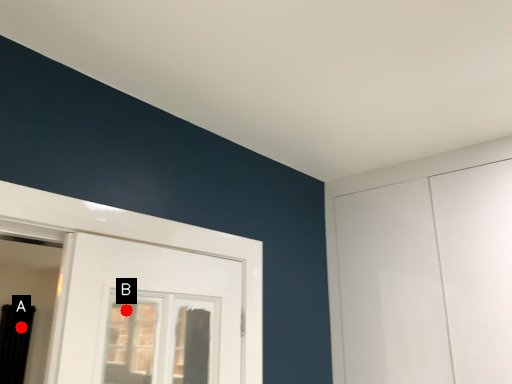
Question: Two points are circled on the image, labeled by A and B beside each circle. Which point appears farthest from the camera in this image?

Choices:
 (A) A is further
 (B) B is further

Answer: (A)